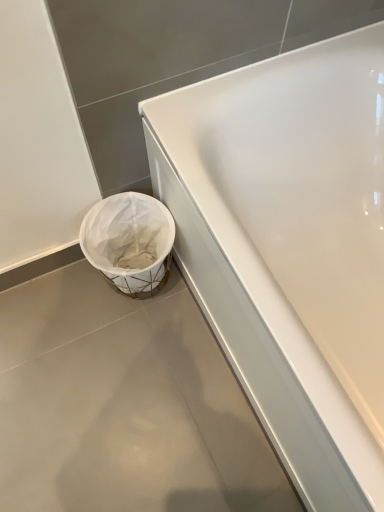
Question: In terms of width, does white glossy bathtub at center look wider or thinner when compared to white matte trash can at lower left?

Choices:
 (A) wide
 (B) thin

Answer: (B)

Question: Is point (355, 151) closer or farther from the camera than point (240, 424)?

Choices:
 (A) farther
 (B) closer

Answer: (B)

Question: Which object is positioned closest to the white matte trash can at lower left?

Choices:
 (A) white glossy bathtub at center
 (B) white fabric basket at lower left

Answer: (B)

Question: Which object is positioned farthest from the white fabric basket at lower left?

Choices:
 (A) white matte trash can at lower left
 (B) white glossy bathtub at center

Answer: (B)